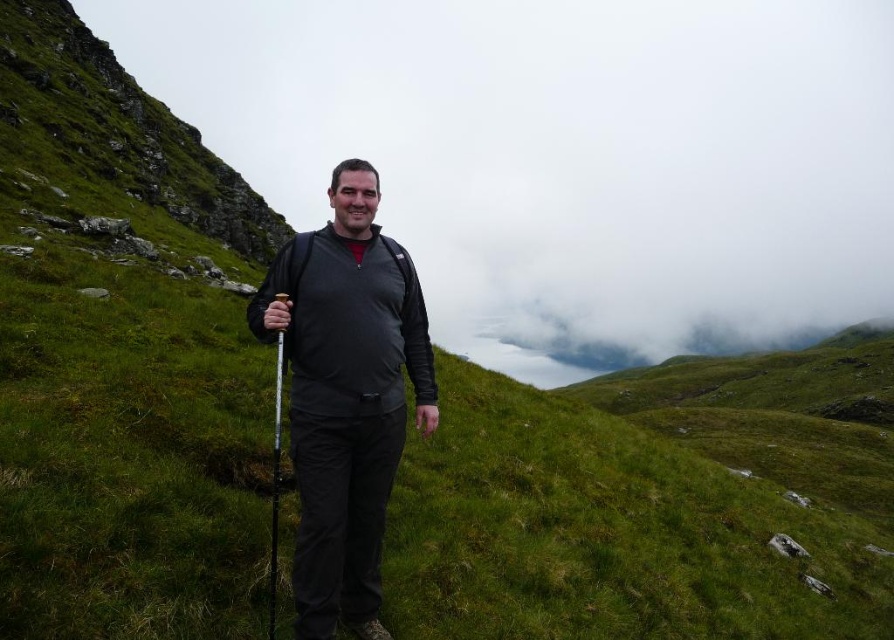
You are a photographer trying to capture the hiker in the scene. The matte black jacket at center and white plastic ski pole at center are both in the frame. Which object should you focus on if you want to capture the larger object in your shot?

The matte black jacket at center is bigger than the white plastic ski pole at center, so you should focus on the matte black jacket at center to capture the larger object in your shot.

You are a photographer trying to capture the hiker in the scene. You need to focus on the matte black jacket at center and the white plastic ski pole at center. Which object should you adjust your camera focus to first if you want to ensure both are in focus?

The matte black jacket at center is above the white plastic ski pole at center, so you should focus on the matte black jacket at center first to ensure both are in focus.

You are a hiker trying to decide whether to pack your matte black jacket at center or your white plastic ski pole at center for a trip. If you can only carry one item, which one should you prioritize based on their sizes?

The matte black jacket at center is wider than the white plastic ski pole at center, so you should prioritize packing the matte black jacket at center since it takes up more space.